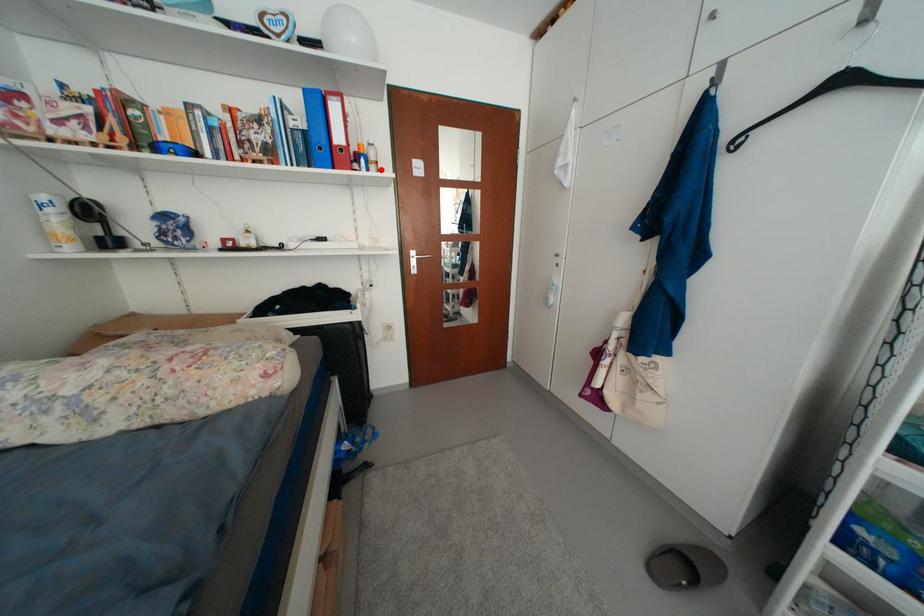
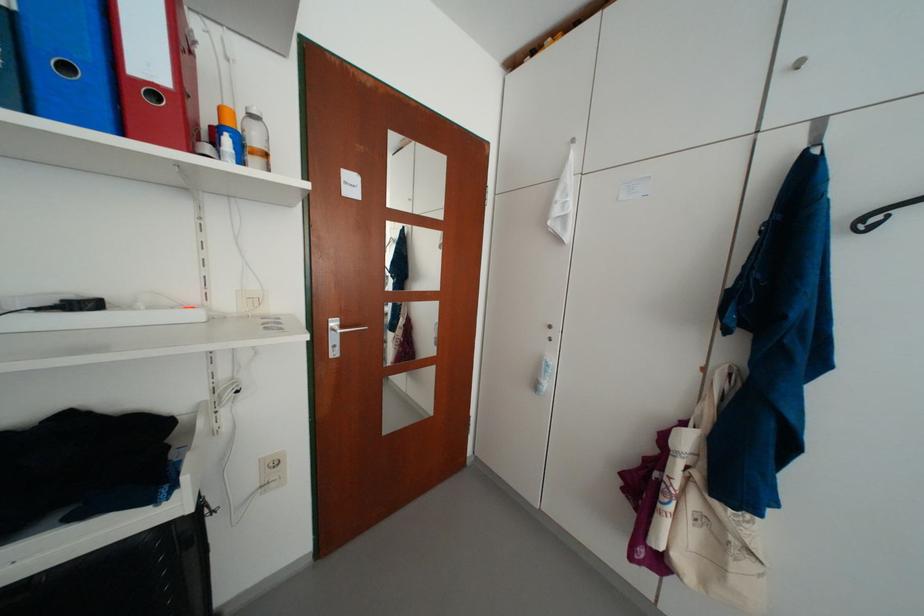
Locate, in the second image, the point that corresponds to the highlighted location in the first image.

(263, 163)